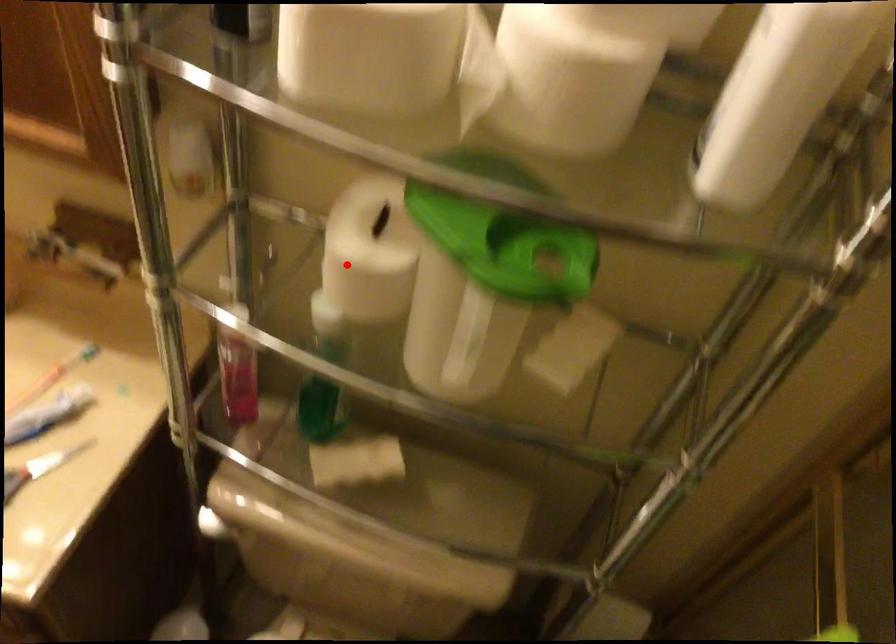
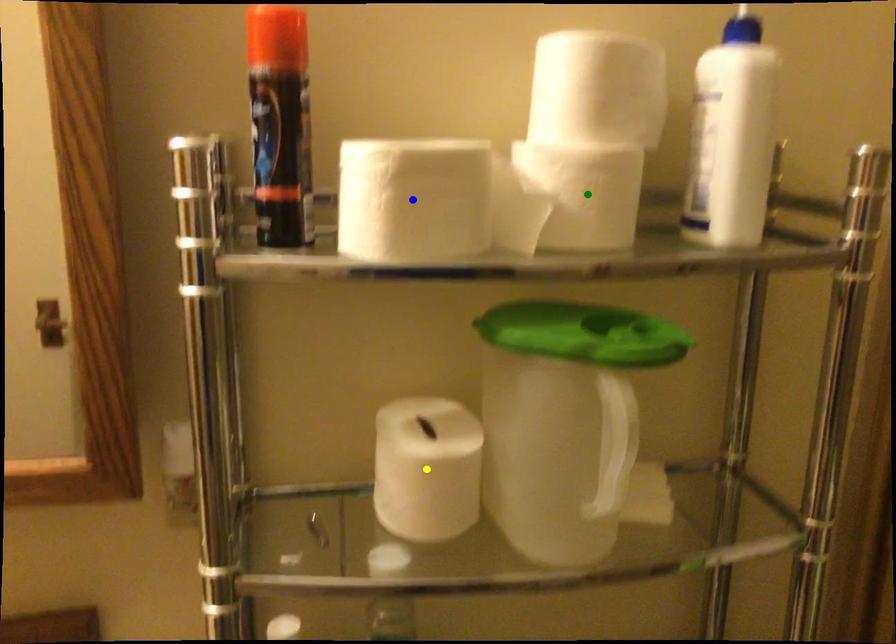
Question: I am providing you with two images of the same scene from different viewpoints. A red point is marked on the first image. You are given multiple points on the second image. Which point in image 2 represents the same 3d spot as the red point in image 1?

Choices:
 (A) green point
 (B) blue point
 (C) yellow point

Answer: (C)